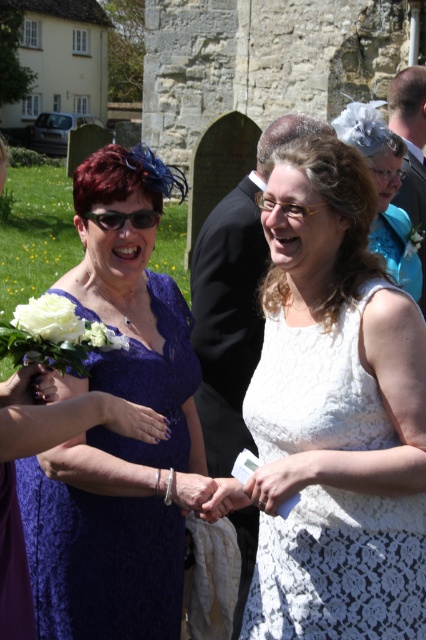
Consider the image. Does black satin suit at center appear on the right side of light brown suit at upper right?

In fact, black satin suit at center is to the left of light brown suit at upper right.

Is point (241, 380) positioned after point (420, 166)?

No, (241, 380) is closer to viewer.

Locate an element on the screen. This screenshot has width=426, height=640. black satin suit at center is located at coordinates (233, 300).

How distant is lace dress at center from black satin suit at center?

lace dress at center and black satin suit at center are 4.24 meters apart from each other.

Is point (71, 604) positioned after point (204, 362)?

No, it is not.

Locate an element on the screen. This screenshot has height=640, width=426. lace dress at center is located at coordinates (115, 435).

Can you confirm if light brown suit at upper right is taller than white matte rose at lower left?

Yes.

Does point (425, 170) lie behind point (71, 317)?

Yes, point (425, 170) is farther from viewer.

Between point (417, 221) and point (58, 332), which one is positioned behind?

The point (417, 221) is behind.

I want to click on light brown suit at upper right, so click(x=409, y=138).